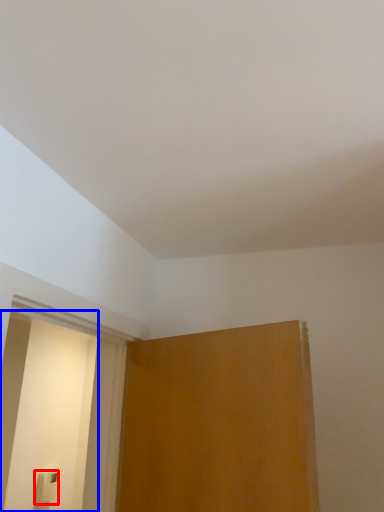
Question: Which object appears farthest to the camera in this image, light switch (highlighted by a red box) or screen door (highlighted by a blue box)?

Choices:
 (A) light switch
 (B) screen door

Answer: (A)